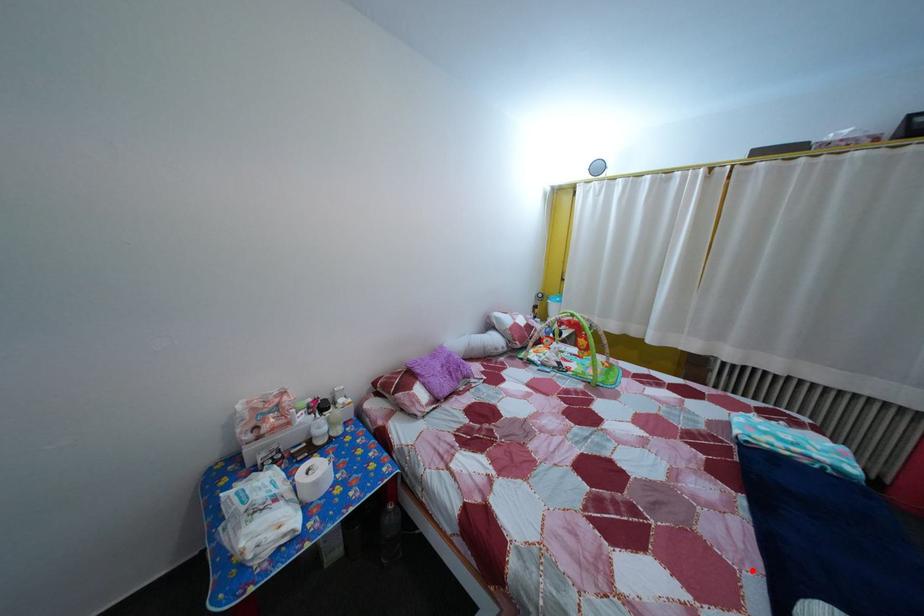
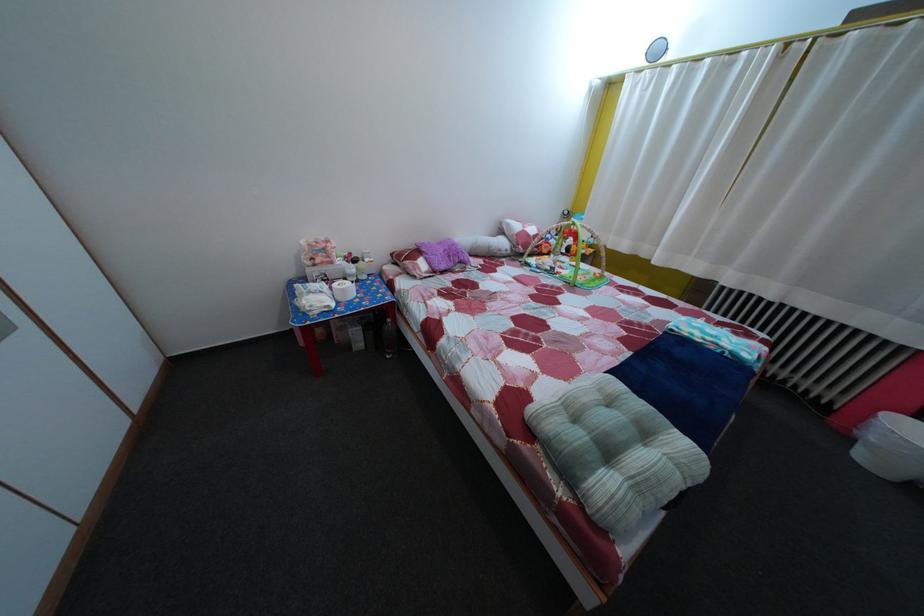
The point at the highlighted location is marked in the first image. Where is the corresponding point in the second image?

(601, 379)